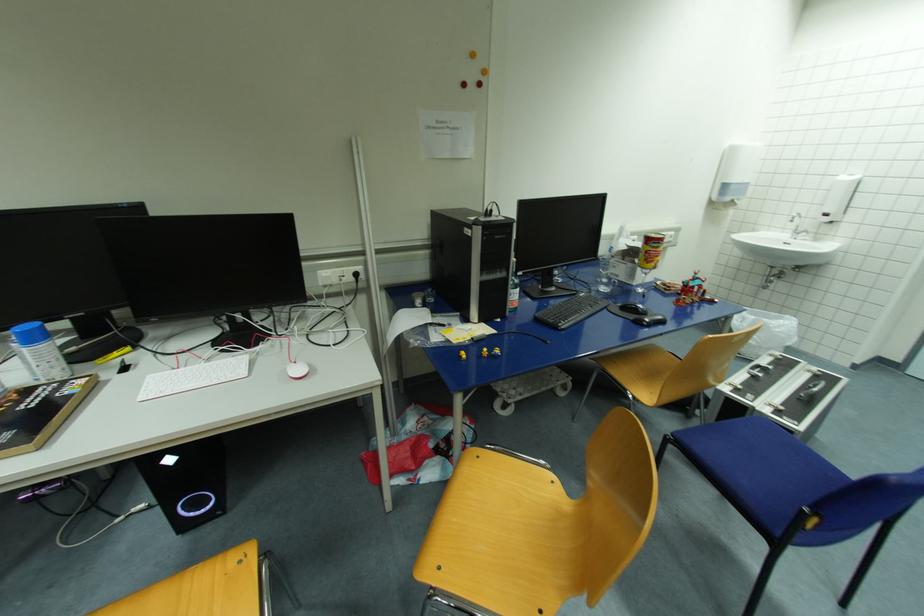
Find where to open the red and yellow can. Please return your answer as a coordinate pair (x, y).

(650, 251)